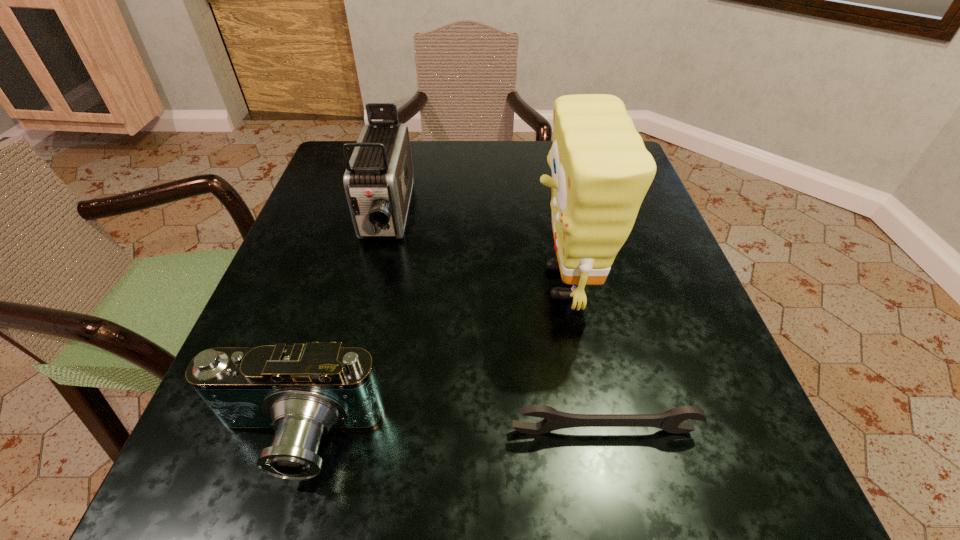
The height and width of the screenshot is (540, 960). In order to click on vacant space located on the open ends of the shortest object in this screenshot , I will do pos(622,517).

Where is `object that is at the far edge`? object that is at the far edge is located at coordinates (378, 181).

Locate an element on the screen. object present at the near edge is located at coordinates (302, 392).

Where is `sponge positioned at the right edge`? This screenshot has height=540, width=960. sponge positioned at the right edge is located at coordinates (601, 171).

The height and width of the screenshot is (540, 960). What are the coordinates of `wrench present at the right edge` in the screenshot? It's located at (671, 421).

This screenshot has width=960, height=540. In order to click on object present at the far left corner in this screenshot , I will do `click(378, 181)`.

Locate an element on the screen. This screenshot has width=960, height=540. object that is at the near left corner is located at coordinates (302, 392).

Locate an element on the screen. blank area at the far edge is located at coordinates (529, 158).

Locate an element on the screen. The image size is (960, 540). free spot at the left edge of the desktop is located at coordinates (362, 273).

At what (x,y) coordinates should I click in order to perform the action: click on vacant region at the right edge of the desktop. Please return your answer as a coordinate pair (x, y). The height and width of the screenshot is (540, 960). Looking at the image, I should click on (641, 308).